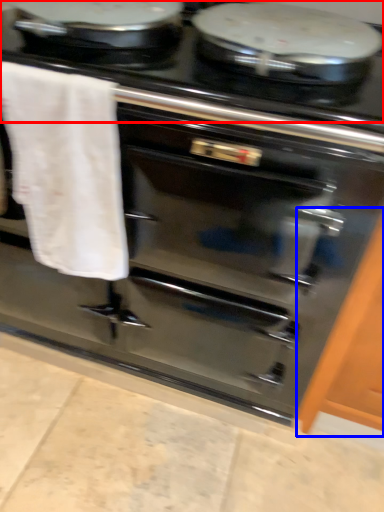
Question: Which point is closer to the camera, gas stove (highlighted by a red box) or cabinetry (highlighted by a blue box)?

Choices:
 (A) gas stove
 (B) cabinetry

Answer: (A)